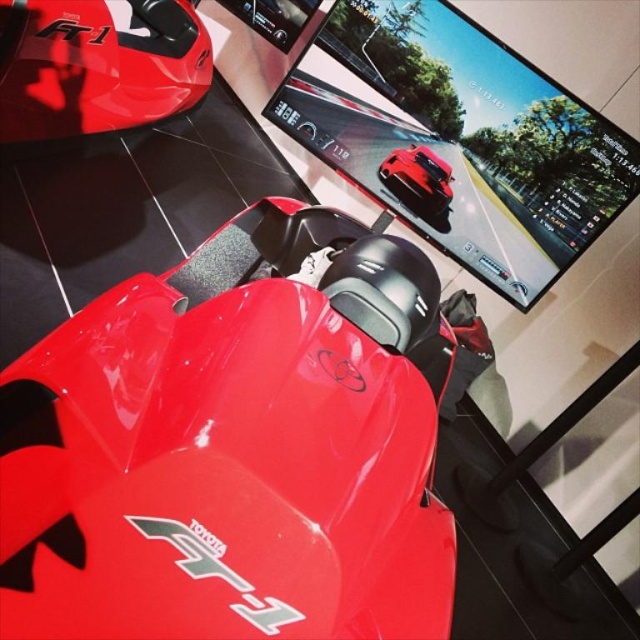
Question: Which object appears farthest from the camera in this image?

Choices:
 (A) glossy plastic monitor at upper center
 (B) glossy red car at center
 (C) glossy red sports car at center

Answer: (B)

Question: Does glossy plastic monitor at upper center have a lesser width compared to glossy red sports car at upper left?

Choices:
 (A) yes
 (B) no

Answer: (B)

Question: Is glossy plastic monitor at upper center positioned behind glossy red car at center?

Choices:
 (A) no
 (B) yes

Answer: (A)

Question: Which object is positioned closest to the glossy red car at center?

Choices:
 (A) glossy red sports car at upper left
 (B) glossy plastic monitor at upper center

Answer: (B)

Question: Can you confirm if glossy red sports car at center is positioned to the right of glossy red car at center?

Choices:
 (A) no
 (B) yes

Answer: (A)

Question: Estimate the real-world distances between objects in this image. Which object is closer to the glossy red sports car at center?

Choices:
 (A) glossy red car at center
 (B) glossy plastic monitor at upper center

Answer: (B)